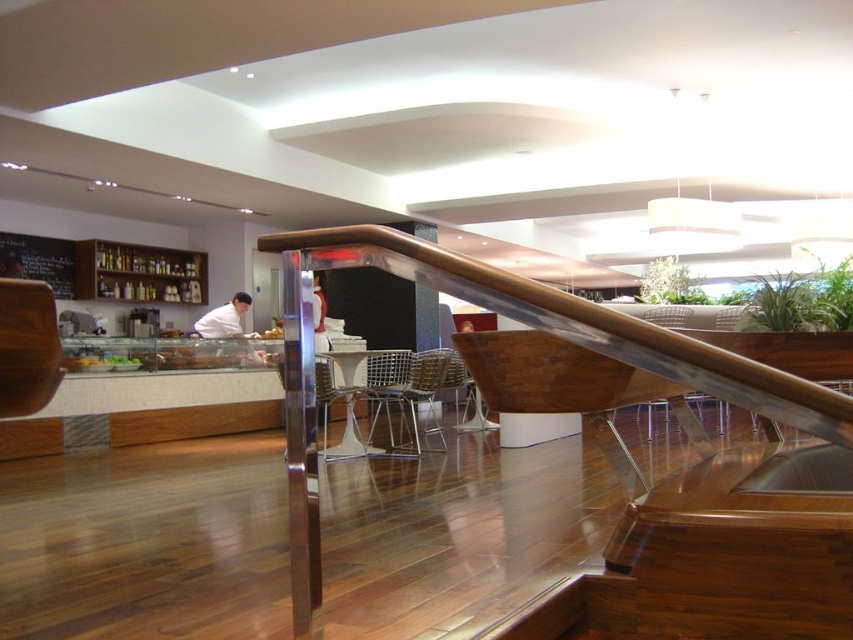
You are designing a layout for a new restaurant and need to place the polished stainless steel handrail at center and the metallic silver chair at center. Based on their sizes, which object should you place closer to the entrance to ensure guests can easily navigate the space?

The polished stainless steel handrail at center is smaller than the metallic silver chair at center, so placing the handrail closer to the entrance would allow for better navigation as it takes up less space.